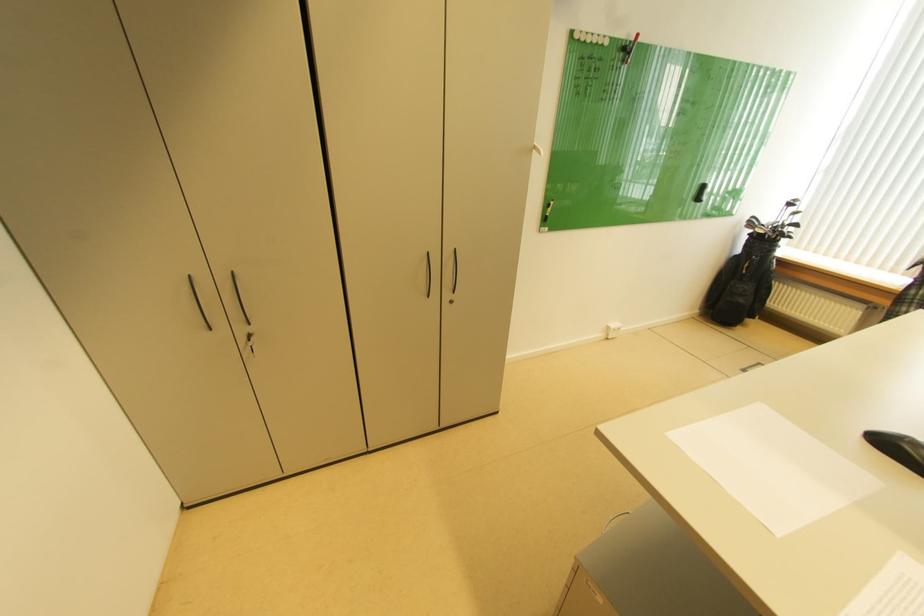
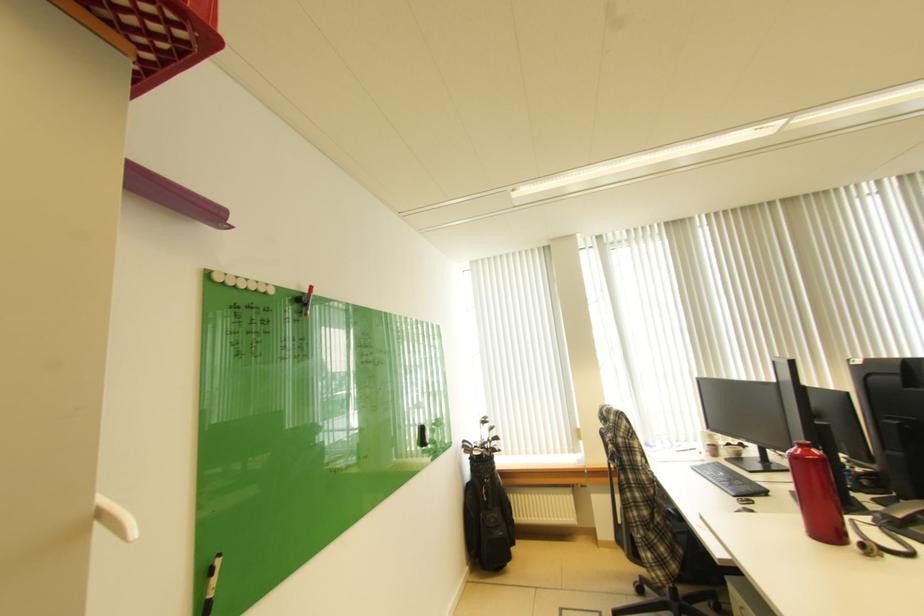
First-person continuous shooting, in which direction is the camera rotating?

The rotation direction of the camera is right-up.